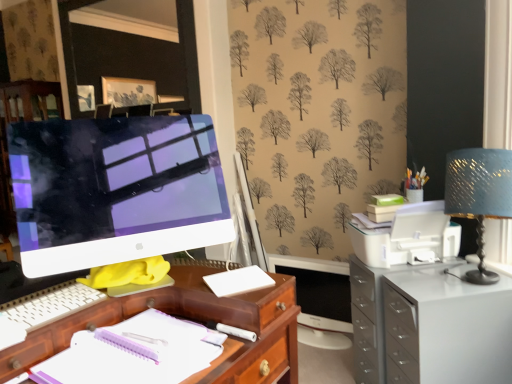
Question: Should I look upward or downward to see white glossy filing cabinet at right?

Choices:
 (A) up
 (B) down

Answer: (B)

Question: From the image's perspective, is white plastic printer at right below white matte cutting board at center?

Choices:
 (A) yes
 (B) no

Answer: (B)

Question: Considering the relative positions of white plastic printer at right and white matte cutting board at center in the image provided, is white plastic printer at right to the left of white matte cutting board at center from the viewer's perspective?

Choices:
 (A) no
 (B) yes

Answer: (A)

Question: Does white plastic printer at right have a lesser width compared to white matte cutting board at center?

Choices:
 (A) yes
 (B) no

Answer: (B)

Question: Does white plastic printer at right come in front of white matte cutting board at center?

Choices:
 (A) no
 (B) yes

Answer: (A)

Question: Is white plastic printer at right shorter than white matte cutting board at center?

Choices:
 (A) yes
 (B) no

Answer: (B)

Question: Is white plastic printer at right wider than white matte cutting board at center?

Choices:
 (A) yes
 (B) no

Answer: (A)

Question: Does white matte cutting board at center have a smaller size compared to white plastic keyboard at lower left?

Choices:
 (A) yes
 (B) no

Answer: (A)

Question: Does white matte cutting board at center have a larger size compared to white plastic keyboard at lower left?

Choices:
 (A) yes
 (B) no

Answer: (B)

Question: Does white matte cutting board at center contain white plastic keyboard at lower left?

Choices:
 (A) yes
 (B) no

Answer: (B)

Question: Is white matte cutting board at center thinner than white plastic keyboard at lower left?

Choices:
 (A) yes
 (B) no

Answer: (A)

Question: Is white matte cutting board at center to the left of white plastic keyboard at lower left from the viewer's perspective?

Choices:
 (A) no
 (B) yes

Answer: (A)

Question: Could you tell me if white matte cutting board at center is facing white plastic keyboard at lower left?

Choices:
 (A) yes
 (B) no

Answer: (B)

Question: Is white glossy computer monitor at left positioned in front of white paper notebook at center?

Choices:
 (A) no
 (B) yes

Answer: (A)